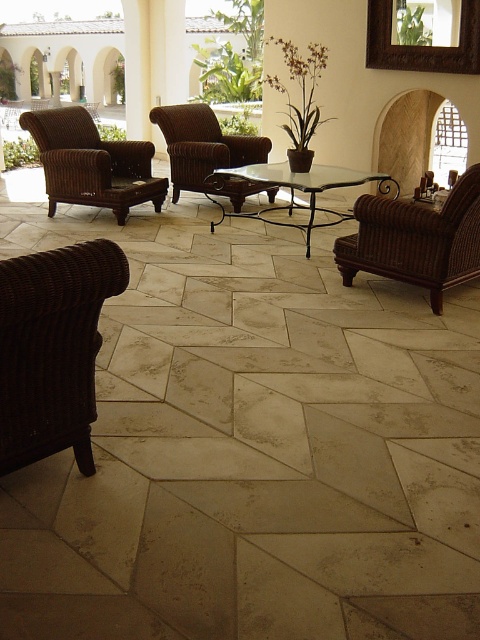
You are a delivery person trying to place a large package on the floor between the natural stone tile at center and the woven brown armchair at right. Can you fit the package there if it measures 1.2 meters in width?

The natural stone tile at center might be wider than the woven brown armchair at right, but since the exact width isn t specified, it s uncertain if the 1.2 meter package will fit. Check the actual dimensions before placing it.

You are sitting in the dark brown woven armchair at lower left and want to place a book on the clear glass table at center. Can you reach it without moving from your seat?

The dark brown woven armchair at lower left is in front of the clear glass table at center, so you can reach the clear glass table at center from your current position without needing to move.